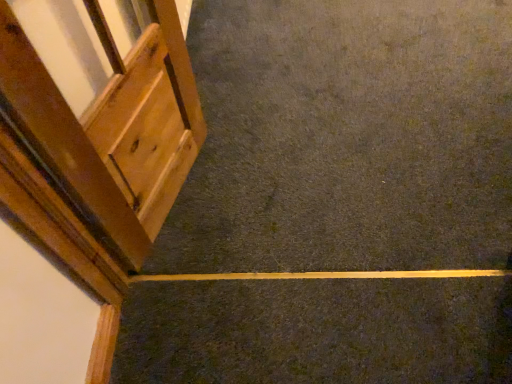
What is the approximate height of wooden door at left?

It is 33.60 inches.

What is the approximate width of wooden door at left?

3.36 inches.

Image resolution: width=512 pixels, height=384 pixels. What do you see at coordinates (110, 127) in the screenshot?
I see `wooden door at left` at bounding box center [110, 127].

In order to face wooden door at left, should I rotate leftwards or rightwards?

Turn left by 14.972 degrees to look at wooden door at left.

Where is `wooden door at left`? wooden door at left is located at coordinates (110, 127).

Measure the distance between point (96, 122) and camera.

95.40 centimeters.

The width and height of the screenshot is (512, 384). Find the location of `wooden door at left`. wooden door at left is located at coordinates (110, 127).